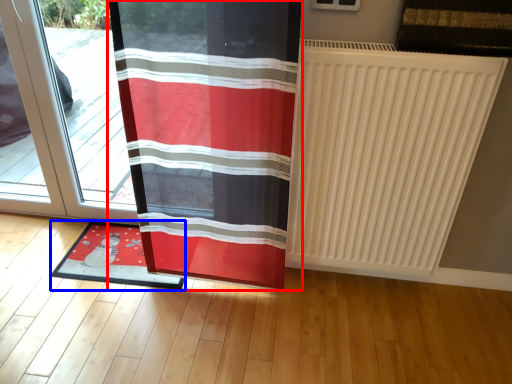
Question: Which object appears farthest to the camera in this image, curtain (highlighted by a red box) or mat (highlighted by a blue box)?

Choices:
 (A) curtain
 (B) mat

Answer: (B)